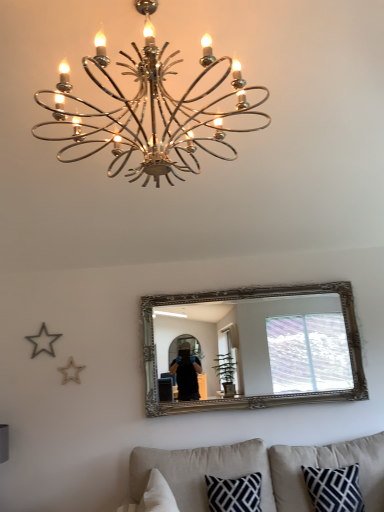
Measure the distance between silver/gilded mirror at center and camera.

silver/gilded mirror at center is 3.38 meters from camera.

The width and height of the screenshot is (384, 512). What are the coordinates of `navy blue textured pillow at lower right` in the screenshot? It's located at (327, 467).

What do you see at coordinates (327, 467) in the screenshot? The width and height of the screenshot is (384, 512). I see `navy blue textured pillow at lower right` at bounding box center [327, 467].

At what (x,y) coordinates should I click in order to perform the action: click on silver/gilded mirror at center. Please return your answer as a coordinate pair (x, y). Image resolution: width=384 pixels, height=512 pixels. Looking at the image, I should click on (267, 346).

Considering the sizes of silver/gilded mirror at center and chrome/metallic chandelier at upper center in the image, is silver/gilded mirror at center wider or thinner than chrome/metallic chandelier at upper center?

silver/gilded mirror at center is thinner than chrome/metallic chandelier at upper center.

Is silver/gilded mirror at center facing towards chrome/metallic chandelier at upper center?

No, silver/gilded mirror at center is not turned towards chrome/metallic chandelier at upper center.

Locate an element on the screen. lamp above the silver/gilded mirror at center (from a real-world perspective) is located at coordinates (150, 111).

In the scene shown: Is navy blue textured pillow at lower right oriented away from silver/gilded mirror at center?

No, navy blue textured pillow at lower right is not facing away from silver/gilded mirror at center.

From the picture: Do you think navy blue textured pillow at lower right is within silver/gilded mirror at center, or outside of it?

The correct answer is: outside.

Does navy blue textured pillow at lower right appear on the right side of silver/gilded mirror at center?

Yes.

From the image's perspective, is navy blue textured pillow at lower right located beneath silver/gilded mirror at center?

Correct, navy blue textured pillow at lower right appears lower than silver/gilded mirror at center in the image.

Between chrome/metallic chandelier at upper center and navy blue textured pillow at lower right, which one has larger width?

chrome/metallic chandelier at upper center.

Is navy blue textured pillow at lower right a part of chrome/metallic chandelier at upper center?

That's incorrect, navy blue textured pillow at lower right is not inside chrome/metallic chandelier at upper center.

This screenshot has width=384, height=512. In the image, there is a navy blue textured pillow at lower right. What are the coordinates of `lamp above it (from the image's perspective)` in the screenshot? It's located at (150, 111).

Is chrome/metallic chandelier at upper center turned away from navy blue textured pillow at lower right?

chrome/metallic chandelier at upper center is not turned away from navy blue textured pillow at lower right.

Which object is more forward, beige fabric couch at lower center or chrome/metallic chandelier at upper center?

chrome/metallic chandelier at upper center.

Can you confirm if beige fabric couch at lower center is taller than chrome/metallic chandelier at upper center?

No.

How many degrees apart are the facing directions of beige fabric couch at lower center and chrome/metallic chandelier at upper center?

There is a 0.252-degree angle between the facing directions of beige fabric couch at lower center and chrome/metallic chandelier at upper center.

From a real-world perspective, is beige fabric couch at lower center positioned above or below chrome/metallic chandelier at upper center?

beige fabric couch at lower center is below chrome/metallic chandelier at upper center.

Is beige fabric couch at lower center shorter than silver/gilded mirror at center?

Yes, beige fabric couch at lower center is shorter than silver/gilded mirror at center.

Can we say beige fabric couch at lower center lies outside silver/gilded mirror at center?

Yes, beige fabric couch at lower center is located beyond the bounds of silver/gilded mirror at center.

Is beige fabric couch at lower center looking in the opposite direction of silver/gilded mirror at center?

No, beige fabric couch at lower center is not facing the opposite direction of silver/gilded mirror at center.

Can you confirm if beige fabric couch at lower center is positioned to the left of silver/gilded mirror at center?

Incorrect, beige fabric couch at lower center is not on the left side of silver/gilded mirror at center.

From the image's perspective, which is below, navy blue textured pillow at lower right or chrome/metallic chandelier at upper center?

navy blue textured pillow at lower right, from the image's perspective.

Which is in front, navy blue textured pillow at lower right or chrome/metallic chandelier at upper center?

chrome/metallic chandelier at upper center is more forward.

In the scene shown: Who is smaller, navy blue textured pillow at lower right or chrome/metallic chandelier at upper center?

navy blue textured pillow at lower right.

Is navy blue textured pillow at lower right situated inside chrome/metallic chandelier at upper center or outside?

navy blue textured pillow at lower right exists outside the volume of chrome/metallic chandelier at upper center.

Considering the positions of points (262, 88) and (315, 389), is point (262, 88) farther from camera compared to point (315, 389)?

No.

Is chrome/metallic chandelier at upper center looking in the opposite direction of silver/gilded mirror at center?

No, silver/gilded mirror at center is not at the back of chrome/metallic chandelier at upper center.

From the image's perspective, which is above, chrome/metallic chandelier at upper center or silver/gilded mirror at center?

chrome/metallic chandelier at upper center, from the image's perspective.

Would you say chrome/metallic chandelier at upper center is a long distance from silver/gilded mirror at center?

Absolutely, chrome/metallic chandelier at upper center is distant from silver/gilded mirror at center.

The image size is (384, 512). Find the location of `mirror beneath the chrome/metallic chandelier at upper center (from a real-world perspective)`. mirror beneath the chrome/metallic chandelier at upper center (from a real-world perspective) is located at coordinates (267, 346).

Where is `mirror that appears behind the navy blue textured pillow at lower right`? The width and height of the screenshot is (384, 512). mirror that appears behind the navy blue textured pillow at lower right is located at coordinates coord(267,346).

In the scene shown: Looking at the image, which one is located further to beige fabric couch at lower center, silver/gilded mirror at center or navy blue textured pillow at lower right?

The object further to beige fabric couch at lower center is silver/gilded mirror at center.

Looking at the image, which one is located closer to silver/gilded mirror at center, chrome/metallic chandelier at upper center or beige fabric couch at lower center?

beige fabric couch at lower center is closer to silver/gilded mirror at center.

Which object lies nearer to the anchor point chrome/metallic chandelier at upper center, navy blue textured pillow at lower right or beige fabric couch at lower center?

Among the two, beige fabric couch at lower center is located nearer to chrome/metallic chandelier at upper center.

In the scene shown: Which object lies nearer to the anchor point beige fabric couch at lower center, silver/gilded mirror at center or chrome/metallic chandelier at upper center?

silver/gilded mirror at center is closer to beige fabric couch at lower center.

Which object lies nearer to the anchor point navy blue textured pillow at lower right, beige fabric couch at lower center or silver/gilded mirror at center?

Among the two, beige fabric couch at lower center is located nearer to navy blue textured pillow at lower right.

Which object lies nearer to the anchor point beige fabric couch at lower center, chrome/metallic chandelier at upper center or navy blue textured pillow at lower right?

Based on the image, navy blue textured pillow at lower right appears to be nearer to beige fabric couch at lower center.

Estimate the real-world distances between objects in this image. Which object is further from silver/gilded mirror at center, beige fabric couch at lower center or navy blue textured pillow at lower right?

navy blue textured pillow at lower right lies further to silver/gilded mirror at center than the other object.

Based on their spatial positions, is silver/gilded mirror at center or navy blue textured pillow at lower right closer to chrome/metallic chandelier at upper center?

silver/gilded mirror at center is positioned closer to the anchor chrome/metallic chandelier at upper center.

Locate an element on the screen. Image resolution: width=384 pixels, height=512 pixels. mirror between chrome/metallic chandelier at upper center and beige fabric couch at lower center in the up-down direction is located at coordinates (267, 346).

Locate an element on the screen. mirror between chrome/metallic chandelier at upper center and navy blue textured pillow at lower right from top to bottom is located at coordinates (267, 346).

This screenshot has width=384, height=512. Find the location of `pillow that lies between chrome/metallic chandelier at upper center and beige fabric couch at lower center from top to bottom`. pillow that lies between chrome/metallic chandelier at upper center and beige fabric couch at lower center from top to bottom is located at coordinates (327, 467).

Identify the location of pillow between beige fabric couch at lower center and silver/gilded mirror at center from front to back. (327, 467).